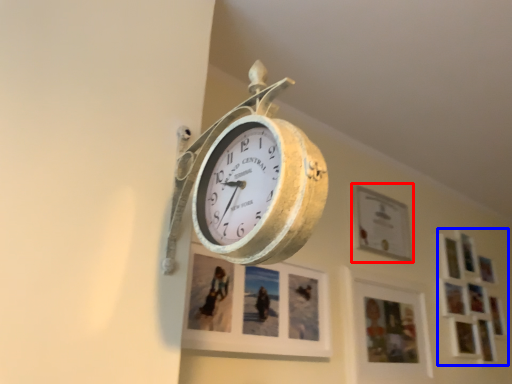
Question: Which of the following is the closest to the observer, picture frame (highlighted by a red box) or picture frame (highlighted by a blue box)?

Choices:
 (A) picture frame
 (B) picture frame

Answer: (A)